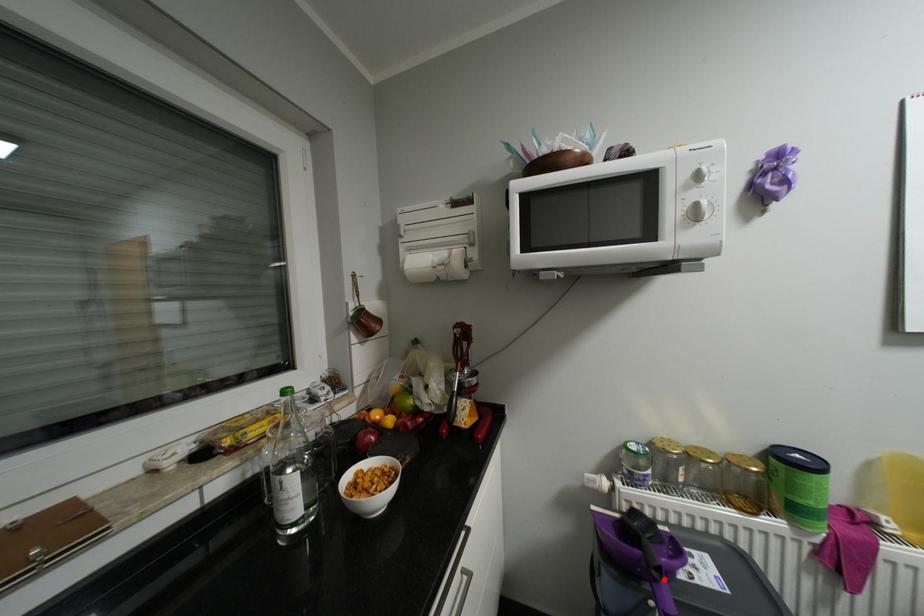
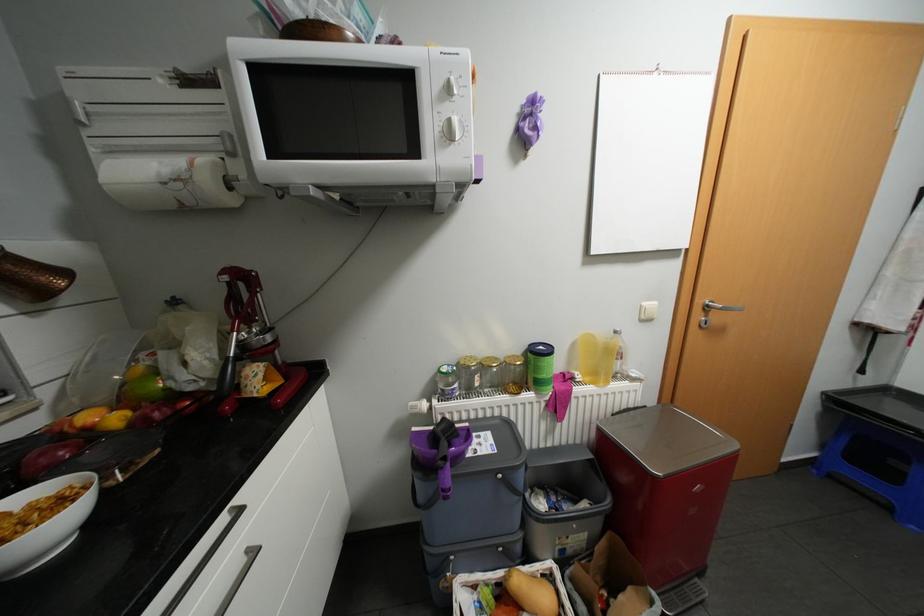
The point at the highlighted location is marked in the first image. Where is the corresponding point in the second image?

(450, 467)